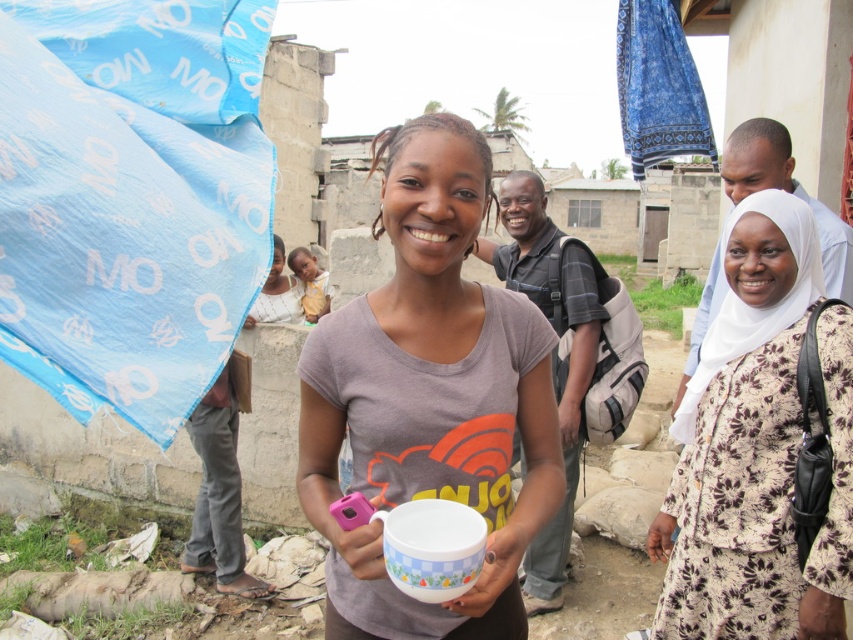
Which of these two, white glossy mug at center or white floral dress at center, stands shorter?

Standing shorter between the two is white glossy mug at center.

Is white glossy mug at center bigger than white floral dress at center?

No, white glossy mug at center is not bigger than white floral dress at center.

Is point (445, 620) positioned after point (831, 381)?

No, it is not.

Identify the location of white glossy mug at center. (428, 396).

Who is shorter, white floral dress at center or yellow fabric baby at center?

yellow fabric baby at center

Does white floral dress at center have a smaller size compared to yellow fabric baby at center?

Actually, white floral dress at center might be larger than yellow fabric baby at center.

Which is in front, point (680, 602) or point (294, 266)?

Point (680, 602)

Image resolution: width=853 pixels, height=640 pixels. Identify the location of white floral dress at center. (757, 448).

Is white glossy mug at center to the left of yellow fabric baby at center from the viewer's perspective?

In fact, white glossy mug at center is to the right of yellow fabric baby at center.

Does point (384, 141) come in front of point (316, 280)?

Yes.

The height and width of the screenshot is (640, 853). What are the coordinates of `white glossy mug at center` in the screenshot? It's located at (428, 396).